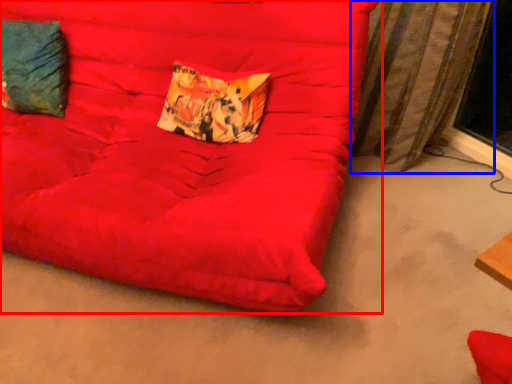
Question: Which object appears closest to the camera in this image, furniture (highlighted by a red box) or curtain (highlighted by a blue box)?

Choices:
 (A) furniture
 (B) curtain

Answer: (A)